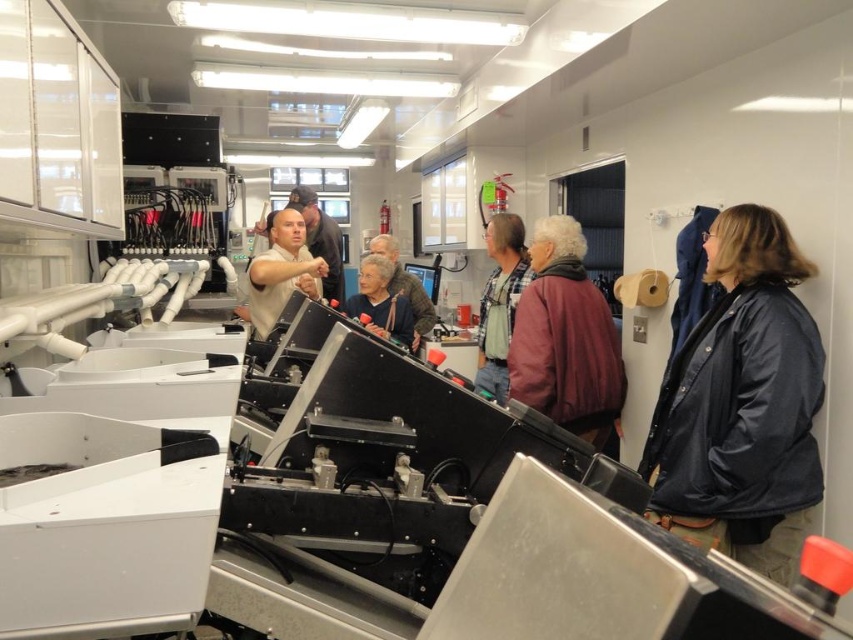
You are an observer standing in front of the machinery in the workshop. You notice two people wearing a maroon fabric jacket at center and a plaid shirt at center. Which person is positioned closer to the right side of the machinery?

The maroon fabric jacket at center is to the right of the plaid shirt at center, so the person wearing the maroon fabric jacket at center is closer to the right side of the machinery.

You are an observer in the workshop. You notice two people wearing the plaid shirt at center and the matte white shirt at center. Which shirt is positioned to the right side of the other?

The plaid shirt at center is to the right of the matte white shirt at center.

You are a safety inspector in this workshop. You notice two workers wearing a plaid shirt at center and a matte black jacket at center. Which worker is closer to you?

The plaid shirt at center is closer to you because it is in front of the matte black jacket at center.